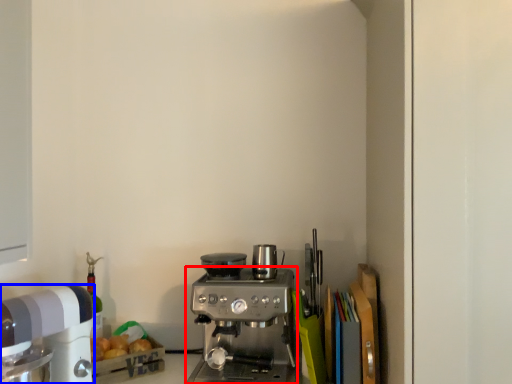
Question: Among these objects, which one is nearest to the camera, coffee maker (highlighted by a red box) or kitchen appliance (highlighted by a blue box)?

Choices:
 (A) coffee maker
 (B) kitchen appliance

Answer: (B)